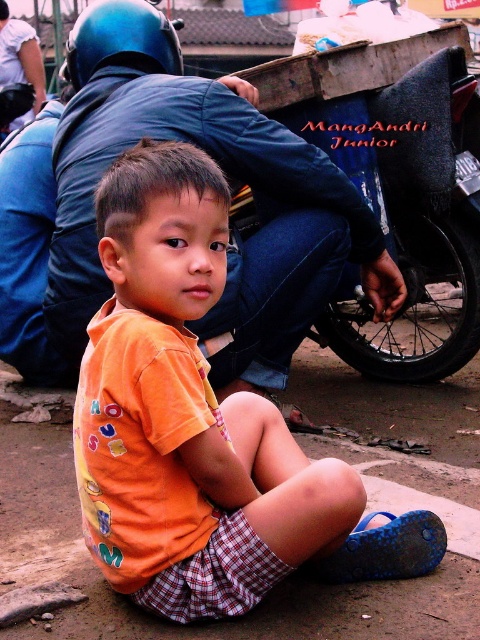
Who is lower down, brown dirt pavement at center or blue matte helmet at upper left?

brown dirt pavement at center

Which is behind, point (15, 424) or point (24, 40)?

Point (24, 40)

You are a GUI agent. You are given a task and a screenshot of the screen. Output one action in this format:
    pyautogui.click(x=<x>, y=<y>)
    Task: Click on the brown dirt pavement at center
    
    Given the screenshot: What is the action you would take?
    pyautogui.click(x=288, y=577)

Between blue denim jacket at upper center and brown dirt pavement at center, which one is positioned higher?

blue denim jacket at upper center is higher up.

The image size is (480, 640). What do you see at coordinates (228, 177) in the screenshot?
I see `blue denim jacket at upper center` at bounding box center [228, 177].

Find the location of a particular element. Image resolution: width=480 pixels, height=640 pixels. blue denim jacket at upper center is located at coordinates (228, 177).

Between blue denim jacket at upper center and blue matte helmet at upper left, which one has less height?

With less height is blue matte helmet at upper left.

Consider the image. Measure the distance between blue denim jacket at upper center and blue matte helmet at upper left.

5.57 feet

What do you see at coordinates (228, 177) in the screenshot? Image resolution: width=480 pixels, height=640 pixels. I see `blue denim jacket at upper center` at bounding box center [228, 177].

Find the location of a particular element. The width and height of the screenshot is (480, 640). blue denim jacket at upper center is located at coordinates click(x=228, y=177).